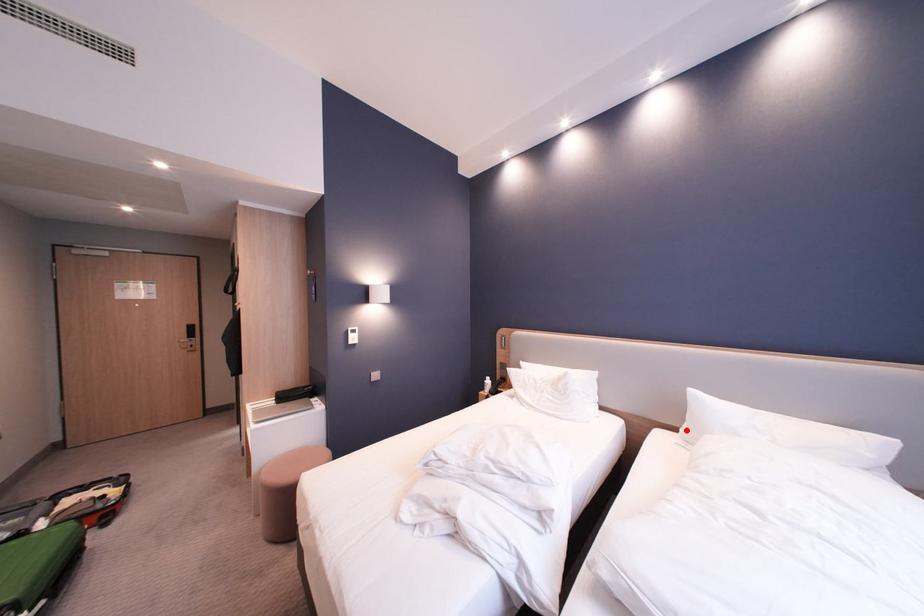
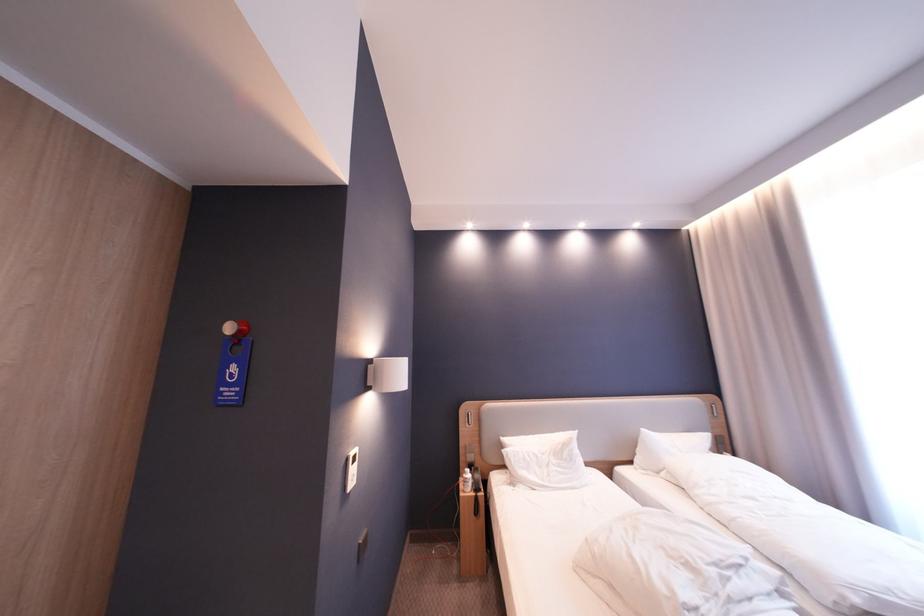
Locate, in the second image, the point that corresponds to the highlighted location in the first image.

(641, 464)